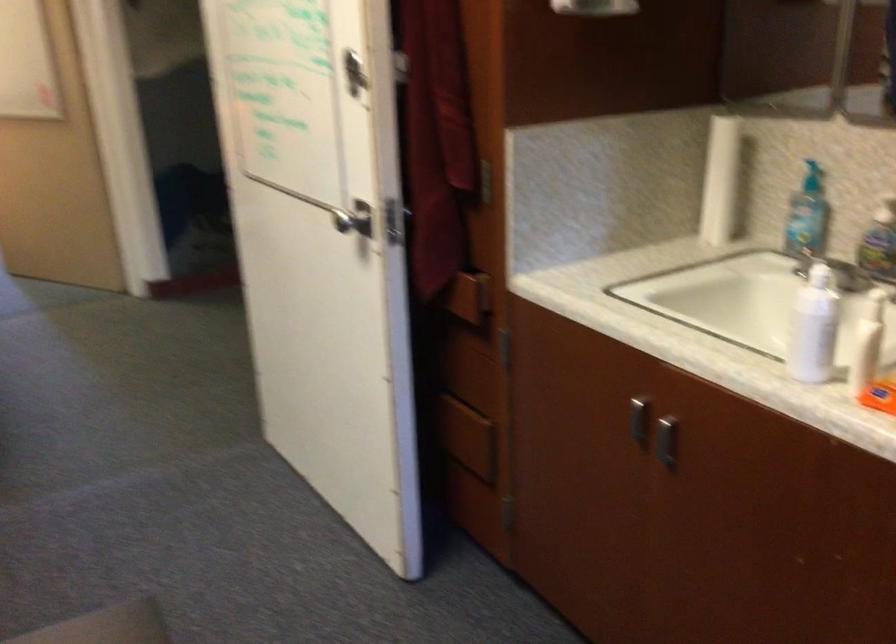
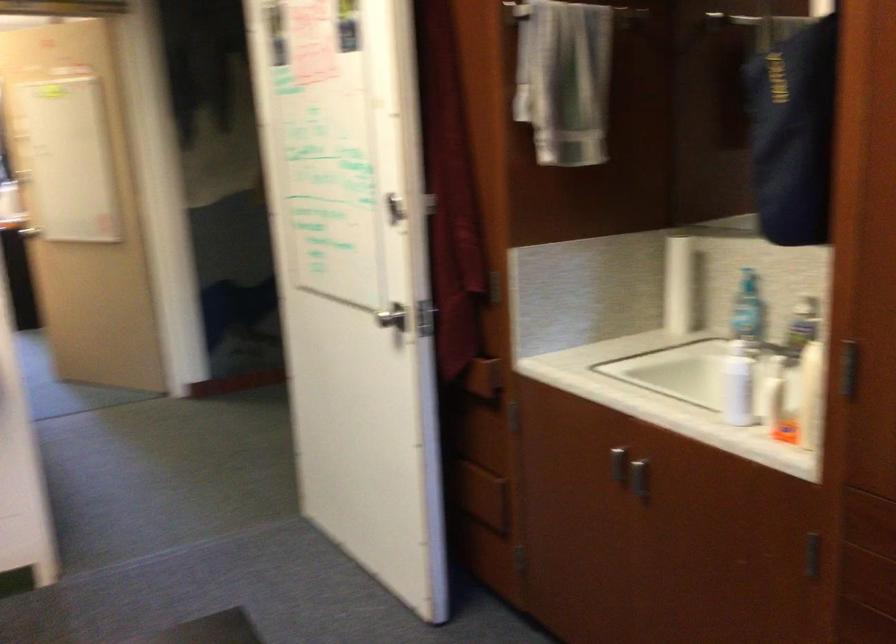
Question: In a continuous first-person perspective shot, in which direction is the camera moving?

Choices:
 (A) Left
 (B) Right
 (C) Forward
 (D) Backward

Answer: (D)